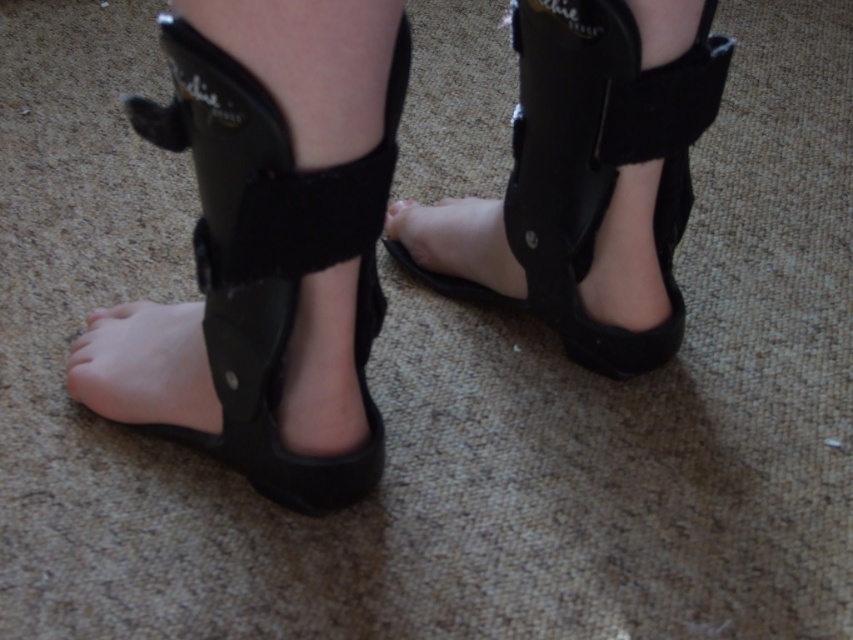
You are standing in a room and see the black suede sandal at lower left. If you move forward 0.5 meters, will you step on the sandal?

The black suede sandal at lower left is located at point (270, 259). Since moving forward 0.5 meters would likely place your foot beyond the sandal, you would not step on it.